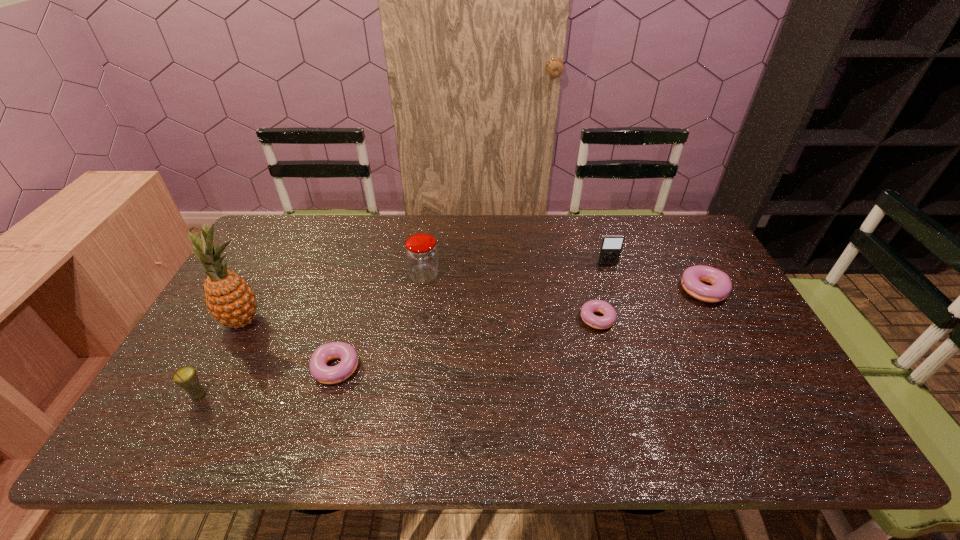
The image size is (960, 540). Identify the location of the nearest doughnut. (319, 370).

What are the coordinates of `the second shortest doughnut` in the screenshot? It's located at (319, 370).

The height and width of the screenshot is (540, 960). What are the coordinates of `the second doughnut from right to left` in the screenshot? It's located at (x=598, y=322).

Locate an element on the screen. The width and height of the screenshot is (960, 540). the shortest object is located at coordinates (598, 322).

Find the location of `the rightmost object`. the rightmost object is located at coordinates (721, 283).

Where is `the tallest object`? This screenshot has width=960, height=540. the tallest object is located at coordinates (229, 298).

The width and height of the screenshot is (960, 540). What are the coordinates of `jar` in the screenshot? It's located at (421, 251).

Identify the location of iPod. (611, 246).

Locate an element on the screen. This screenshot has height=540, width=960. the farthest object is located at coordinates (611, 246).

Locate an element on the screen. This screenshot has height=540, width=960. straw for drinking is located at coordinates (186, 377).